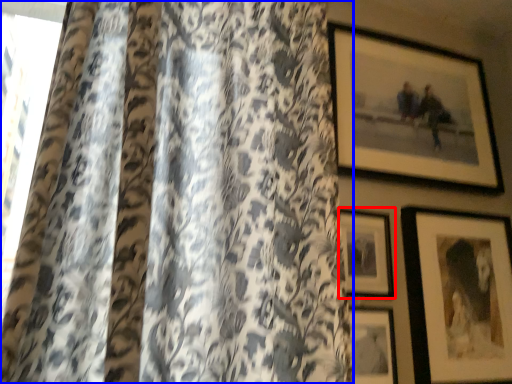
Question: Which point is closer to the camera, picture frame (highlighted by a red box) or curtain (highlighted by a blue box)?

Choices:
 (A) picture frame
 (B) curtain

Answer: (B)